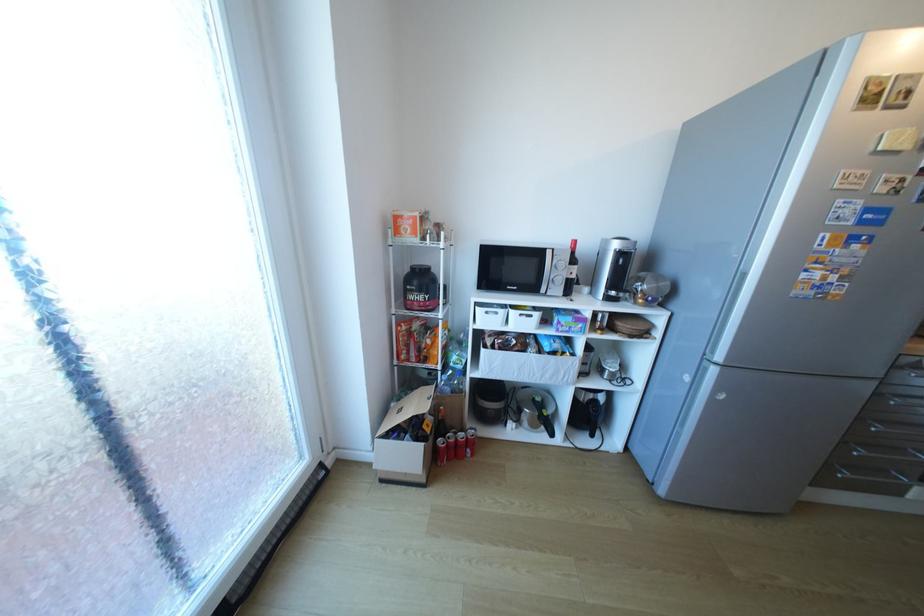
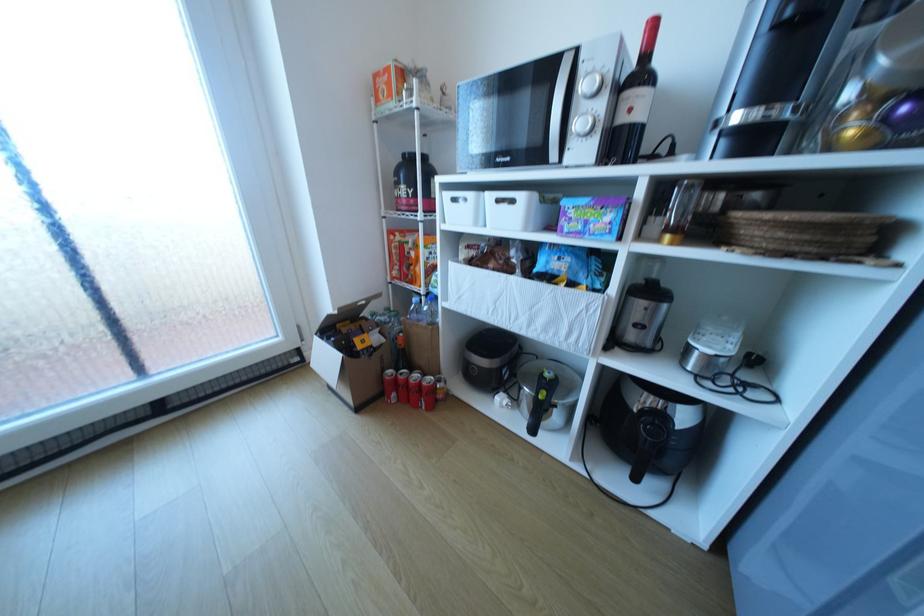
Question: How did the camera likely rotate?

Choices:
 (A) Left
 (B) Right
 (C) Up
 (D) Down

Answer: (A)